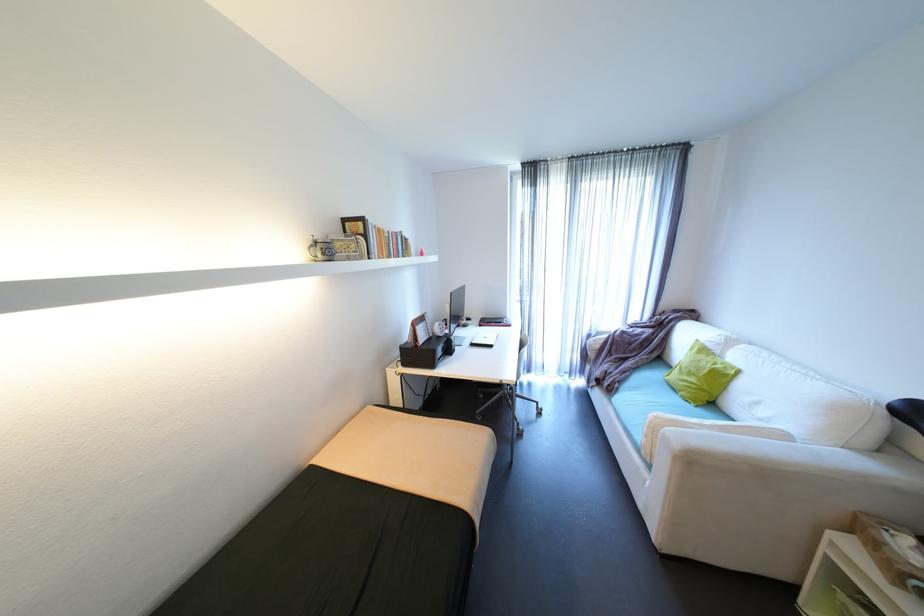
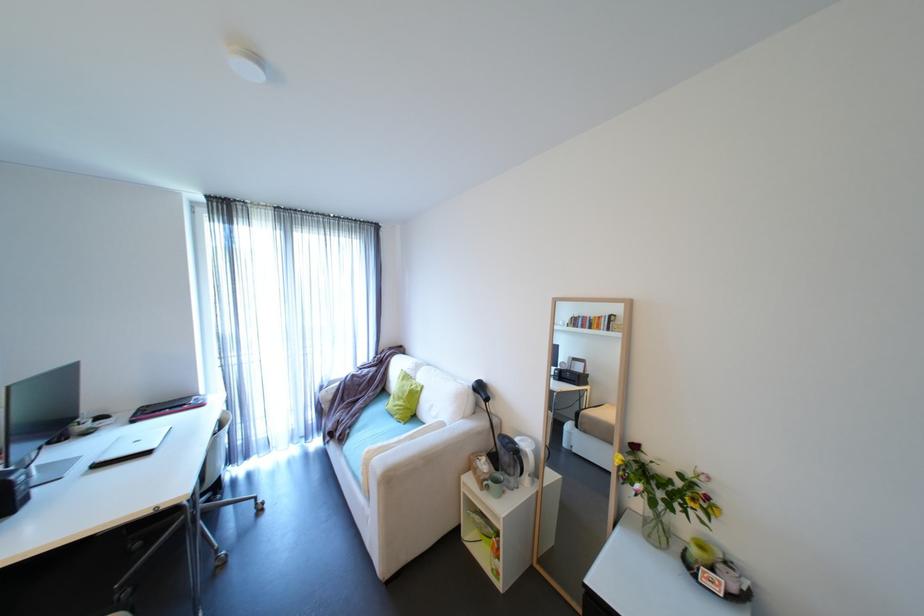
Locate, in the second image, the point that corresponds to point 706,381 in the first image.

(411, 402)